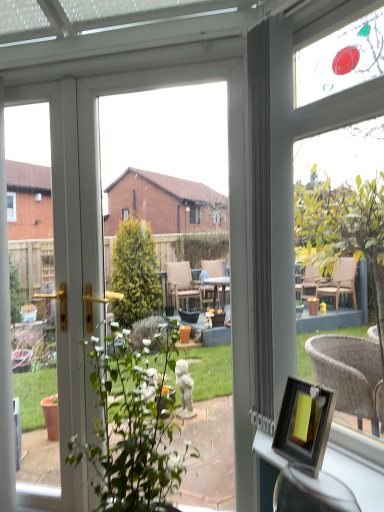
Question: Is wooden frame at lower right at the right side of green leafy plant at center?

Choices:
 (A) no
 (B) yes

Answer: (B)

Question: Is wooden frame at lower right far away from green leafy plant at center?

Choices:
 (A) yes
 (B) no

Answer: (B)

Question: Does wooden frame at lower right lie in front of green leafy plant at center?

Choices:
 (A) yes
 (B) no

Answer: (A)

Question: Is green leafy plant at center at the back of wooden frame at lower right?

Choices:
 (A) no
 (B) yes

Answer: (A)

Question: From the image's perspective, is wooden frame at lower right on green leafy plant at center?

Choices:
 (A) no
 (B) yes

Answer: (B)

Question: Relative to matte wicker chair at upper right, is wooden picture frame at lower right in front or behind?

Choices:
 (A) front
 (B) behind

Answer: (B)

Question: Is wooden picture frame at lower right bigger or smaller than matte wicker chair at upper right?

Choices:
 (A) small
 (B) big

Answer: (A)

Question: From the image's perspective, is wooden picture frame at lower right positioned above or below matte wicker chair at upper right?

Choices:
 (A) below
 (B) above

Answer: (A)

Question: From their relative heights in the image, would you say wooden picture frame at lower right is taller or shorter than matte wicker chair at upper right?

Choices:
 (A) short
 (B) tall

Answer: (A)

Question: Is point click(x=172, y=466) positioned closer to the camera than point click(x=354, y=444)?

Choices:
 (A) closer
 (B) farther

Answer: (B)

Question: In terms of width, does green leafy plant at center look wider or thinner when compared to wooden frame at lower right?

Choices:
 (A) thin
 (B) wide

Answer: (B)

Question: From the image's perspective, is green leafy plant at center located above or below wooden frame at lower right?

Choices:
 (A) below
 (B) above

Answer: (A)

Question: Is green leafy plant at center taller or shorter than wooden frame at lower right?

Choices:
 (A) tall
 (B) short

Answer: (A)

Question: Considering the positions of green leafy plant at center and matte wicker chair at upper right in the image, is green leafy plant at center bigger or smaller than matte wicker chair at upper right?

Choices:
 (A) big
 (B) small

Answer: (A)

Question: From the image's perspective, relative to matte wicker chair at upper right, is green leafy plant at center above or below?

Choices:
 (A) below
 (B) above

Answer: (A)